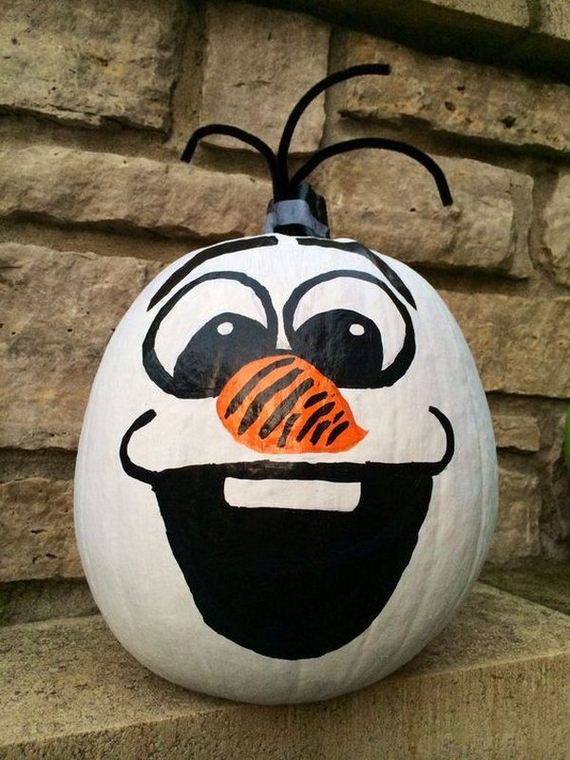
Where is `brick walls`? This screenshot has height=760, width=570. brick walls is located at coordinates (85, 96).